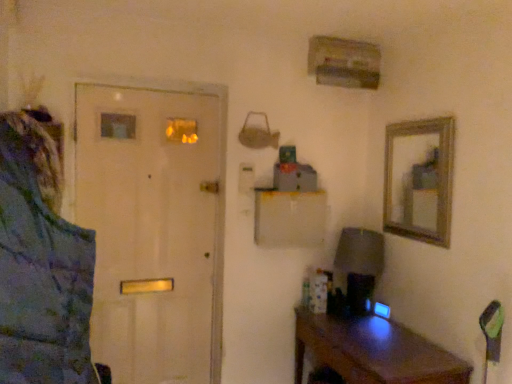
The image size is (512, 384). I want to click on free space in front of matte gray lampshade at right, so click(x=375, y=327).